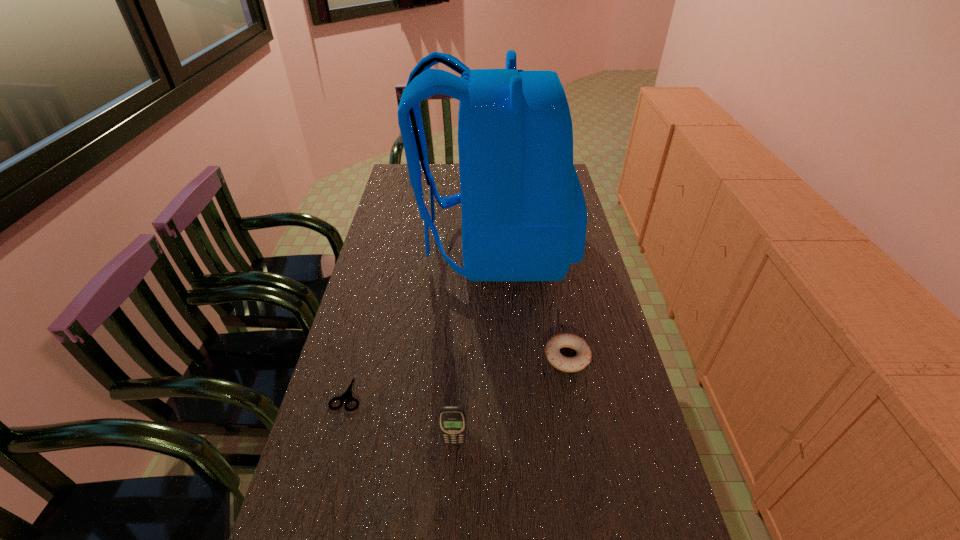
At what (x,y) coordinates should I click in order to perform the action: click on backpack. Please return your answer as a coordinate pair (x, y). Looking at the image, I should click on (524, 216).

I want to click on the farthest object, so click(x=524, y=216).

I want to click on the nearest object, so click(452, 419).

Identify the location of the second tallest object. (452, 419).

This screenshot has height=540, width=960. In order to click on the second shortest object in this screenshot , I will do [x=552, y=349].

This screenshot has height=540, width=960. I want to click on shears, so click(347, 396).

Where is `the shortest object`? The image size is (960, 540). the shortest object is located at coordinates (347, 396).

Locate an element on the screen. vacant space located 0.150m on the back of the backpack is located at coordinates (374, 247).

You are a GUI agent. You are given a task and a screenshot of the screen. Output one action in this format:
    pyautogui.click(x=<x>, y=<y>)
    Task: Click on the vacant space located on the back of the backpack
    
    Given the screenshot: What is the action you would take?
    pyautogui.click(x=377, y=247)

This screenshot has width=960, height=540. Identify the location of free point located 0.110m on the screen of the cellular telephone. (451, 497).